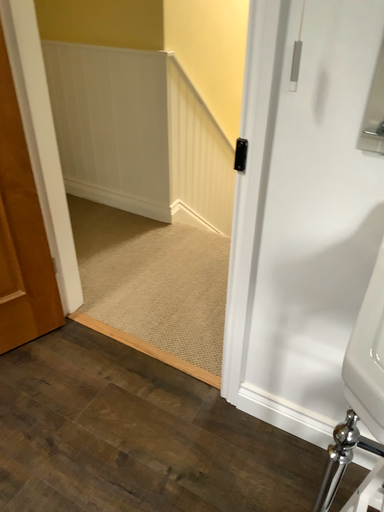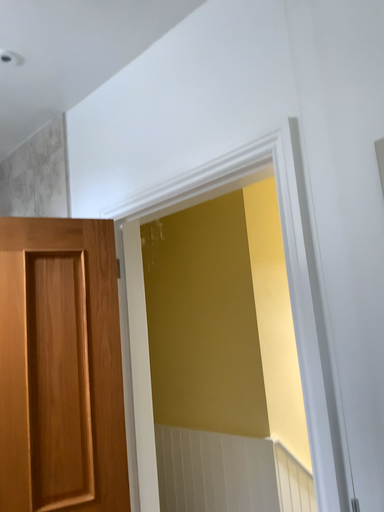
Question: How did the camera likely rotate when shooting the video?

Choices:
 (A) rotated downward
 (B) rotated upward

Answer: (B)